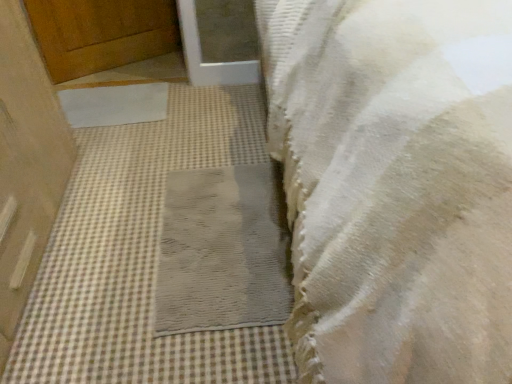
I want to click on vacant space to the right of wooden door at left, acting as the first door starting from the front, so click(161, 235).